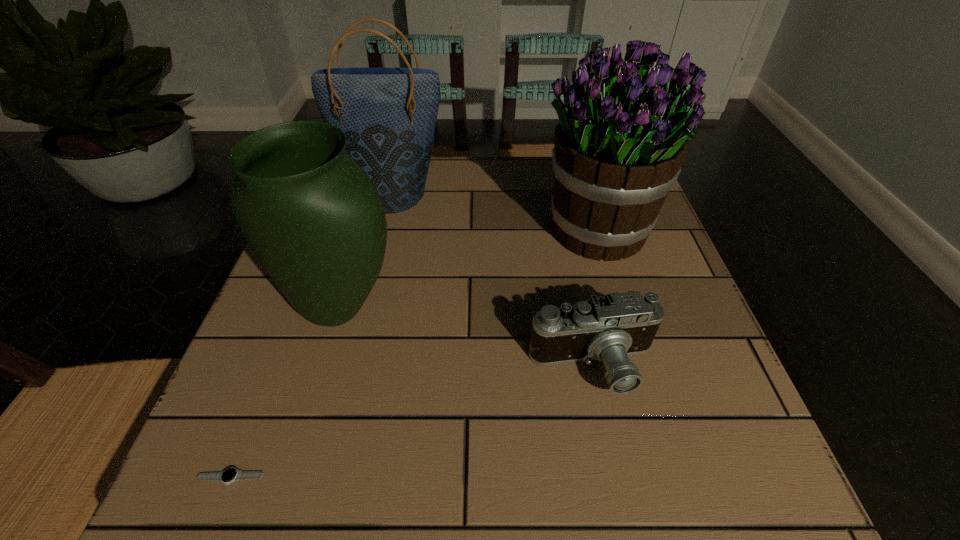
This screenshot has width=960, height=540. What are the coordinates of `object that is at the near left corner` in the screenshot? It's located at (229, 475).

The height and width of the screenshot is (540, 960). Find the location of `object located at the far right corner`. object located at the far right corner is located at coordinates (624, 128).

In order to click on vacant space at the far edge in this screenshot , I will do `click(455, 168)`.

In the image, there is a desktop. Where is `vacant space at the near edge`? The image size is (960, 540). vacant space at the near edge is located at coordinates (415, 468).

In order to click on free space at the left edge in this screenshot , I will do `click(310, 330)`.

Where is `vacant space at the right edge`? Image resolution: width=960 pixels, height=540 pixels. vacant space at the right edge is located at coordinates (651, 273).

This screenshot has width=960, height=540. Find the location of `free space at the near left corner of the desktop`. free space at the near left corner of the desktop is located at coordinates (192, 477).

Identify the location of free spot between the shopping bag and the nearest object. This screenshot has height=540, width=960. (312, 335).

At what (x,y) coordinates should I click in order to perform the action: click on free space between the shopping bag and the second shortest object. Please return your answer as a coordinate pair (x, y). This screenshot has height=540, width=960. Looking at the image, I should click on (493, 280).

Identify the location of blank region between the nearest object and the shopping bag. This screenshot has width=960, height=540. (312, 335).